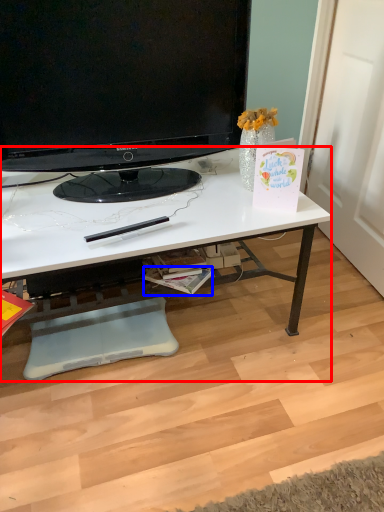
Question: Which object is closer to the camera taking this photo, desk (highlighted by a red box) or magazine (highlighted by a blue box)?

Choices:
 (A) desk
 (B) magazine

Answer: (A)